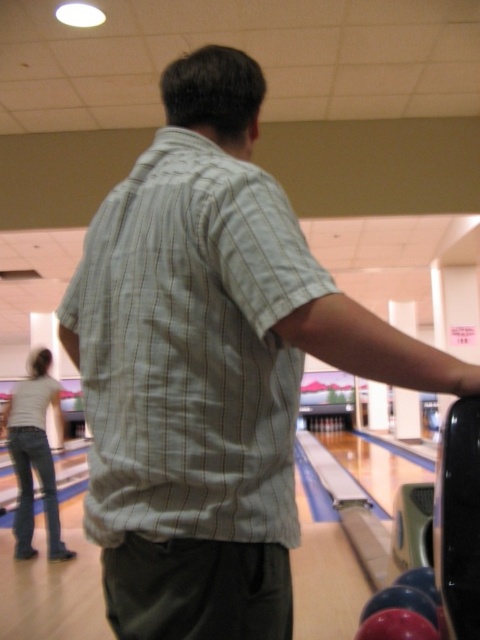
From the picture: You are a photographer positioned at the back of the bowling alley. You need to capture a photo of the light green striped shirt at center and the white cotton shirt at lower left. Which shirt should you zoom in on to ensure both shirts are clearly visible in the photo?

The light green striped shirt at center has a lesser width compared to white cotton shirt at lower left, so you should zoom in on the white cotton shirt at lower left to ensure both shirts are clearly visible in the photo.

You are a photographer standing at the entrance of the bowling alley. You need to take a photo of both the light green striped shirt at center and the white cotton shirt at lower left. Which one should you focus on first to ensure both are in frame?

The light green striped shirt at center is located above the white cotton shirt at lower left, so you should focus on the light green striped shirt at center first to ensure both are in frame.

You are a photographer positioned at the back of the bowling alley. You want to take a photo of the light green striped shirt at center and the white cotton shirt at lower left. Which shirt should you focus on first to ensure both are in sharp focus?

You should focus on the light green striped shirt at center first because it is closer to the viewer than the white cotton shirt at lower left, so adjusting focus from near to far will help both shirts be in sharp focus.